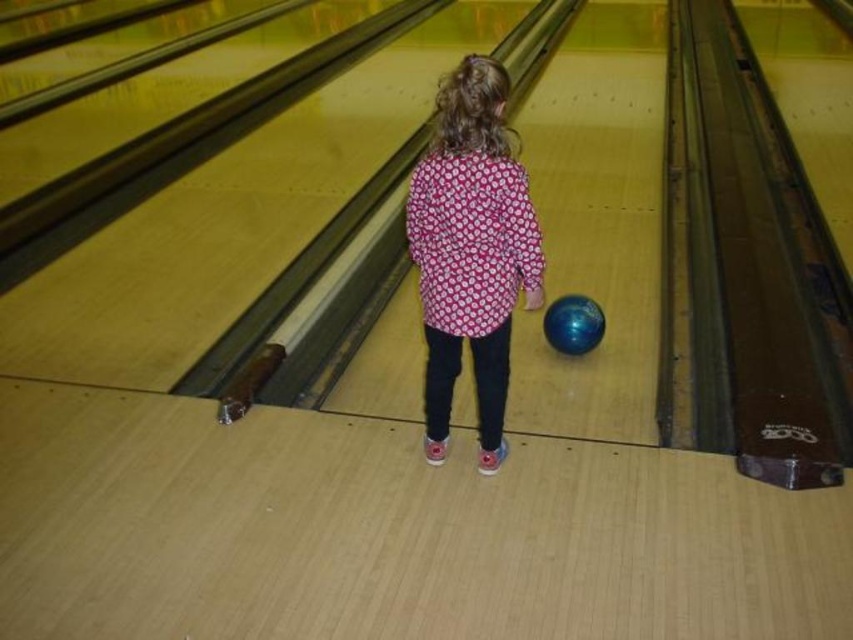
In the scene shown: Which of these two, pink dotted shirt at center or blue glossy bowling ball at center, stands shorter?

Standing shorter between the two is blue glossy bowling ball at center.

Can you confirm if pink dotted shirt at center is shorter than blue glossy bowling ball at center?

No.

Describe the element at coordinates (471, 250) in the screenshot. Image resolution: width=853 pixels, height=640 pixels. I see `pink dotted shirt at center` at that location.

The image size is (853, 640). In order to click on pink dotted shirt at center in this screenshot , I will do `click(471, 250)`.